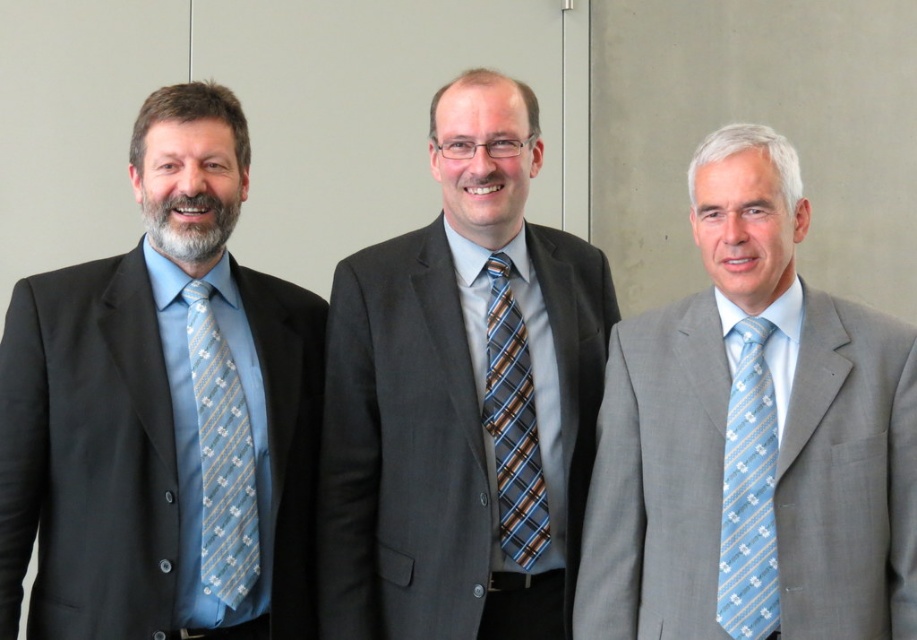
Does light gray suit at right have a lesser height compared to light blue silk tie at right?

In fact, light gray suit at right may be taller than light blue silk tie at right.

Consider the image. Is light gray suit at right further to the viewer compared to light blue silk tie at right?

That is False.

Identify the location of light gray suit at right. (752, 438).

Who is more forward, (21, 371) or (776, 164)?

Point (21, 371)

Is matte black suit at left to the left of light gray suit at right from the viewer's perspective?

Indeed, matte black suit at left is positioned on the left side of light gray suit at right.

Between point (253, 548) and point (851, 592), which one is positioned in front?

Point (851, 592) is more forward.

This screenshot has height=640, width=917. Identify the location of matte black suit at left. (163, 413).

Does matte gray suit at center have a lesser width compared to light blue silk tie at left?

Incorrect, matte gray suit at center's width is not less than light blue silk tie at left's.

Is matte gray suit at center closer to camera compared to light blue silk tie at left?

No, matte gray suit at center is further to the viewer.

Is point (346, 397) behind point (242, 513)?

Yes, point (346, 397) is farther from viewer.

In order to click on matte gray suit at center in this screenshot , I will do `click(462, 397)`.